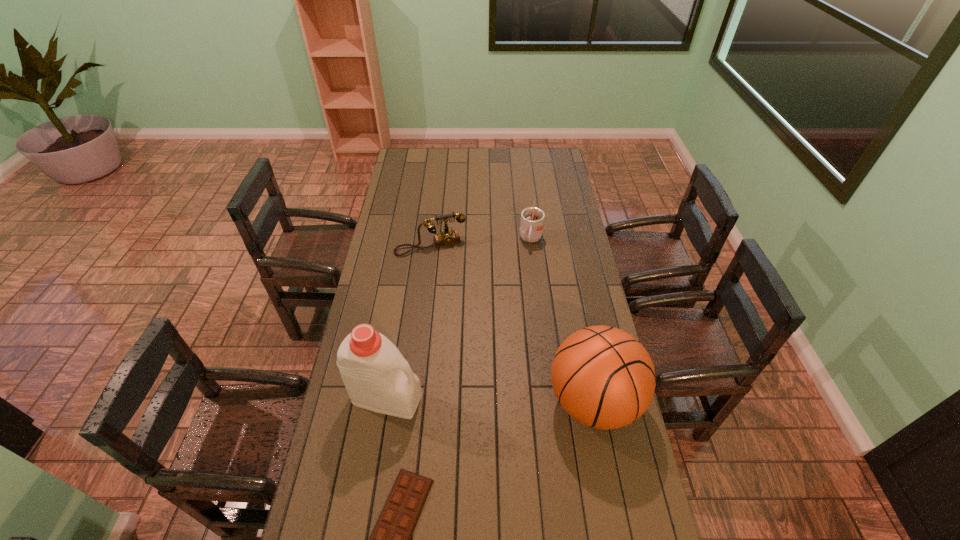
This screenshot has width=960, height=540. What are the coordinates of `blank space at the far left corner of the desktop` in the screenshot? It's located at (419, 156).

This screenshot has height=540, width=960. I want to click on unoccupied area between the telephone and the detergent, so click(x=409, y=322).

You are a GUI agent. You are given a task and a screenshot of the screen. Output one action in this format:
    pyautogui.click(x=<x>, y=<y>)
    Task: Click on the free point between the telephone and the detergent
    This screenshot has width=960, height=540.
    Given the screenshot: What is the action you would take?
    pyautogui.click(x=409, y=322)

You are a GUI agent. You are given a task and a screenshot of the screen. Output one action in this format:
    pyautogui.click(x=<x>, y=<y>)
    Task: Click on the unoccupied position between the cup and the basketball
    The image size is (960, 540).
    Given the screenshot: What is the action you would take?
    pyautogui.click(x=562, y=321)

The width and height of the screenshot is (960, 540). Find the location of `free space between the cup and the telephone`. free space between the cup and the telephone is located at coordinates (481, 243).

The height and width of the screenshot is (540, 960). What are the coordinates of `free space that is in between the cup and the basketball` in the screenshot? It's located at (562, 321).

I want to click on vacant area between the telephone and the detergent, so click(409, 322).

The width and height of the screenshot is (960, 540). What are the coordinates of `object that is the second closest to the basketball` in the screenshot? It's located at (377, 377).

Select which object appears as the closest to the shortest object. Please provide its 2D coordinates. Your answer should be formatted as a tuple, i.e. [(x, y)], where the tuple contains the x and y coordinates of a point satisfying the conditions above.

[(377, 377)]

Locate an element on the screen. The height and width of the screenshot is (540, 960). vacant space that satisfies the following two spatial constraints: 1. on the front side of the basketball; 2. on the left side of the telephone is located at coordinates (413, 401).